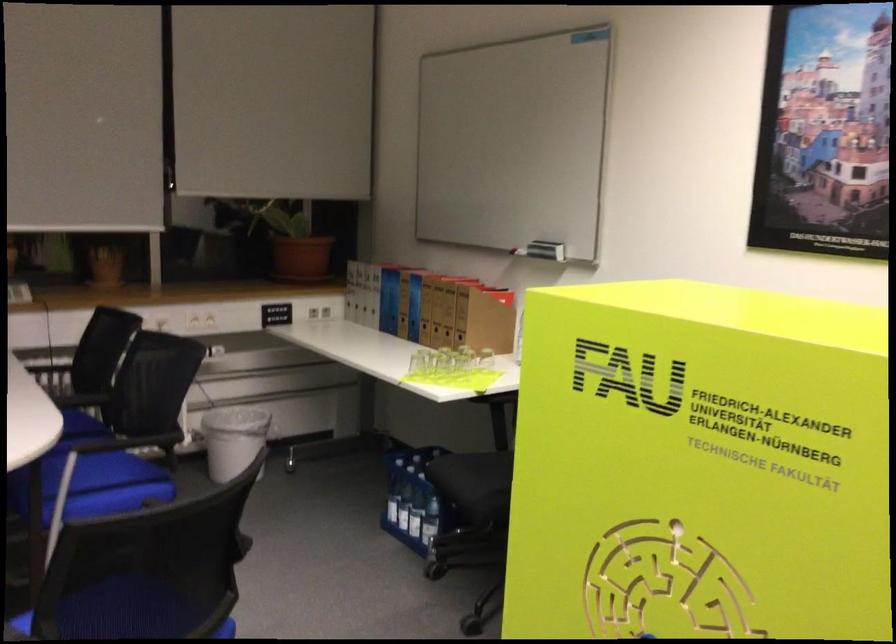
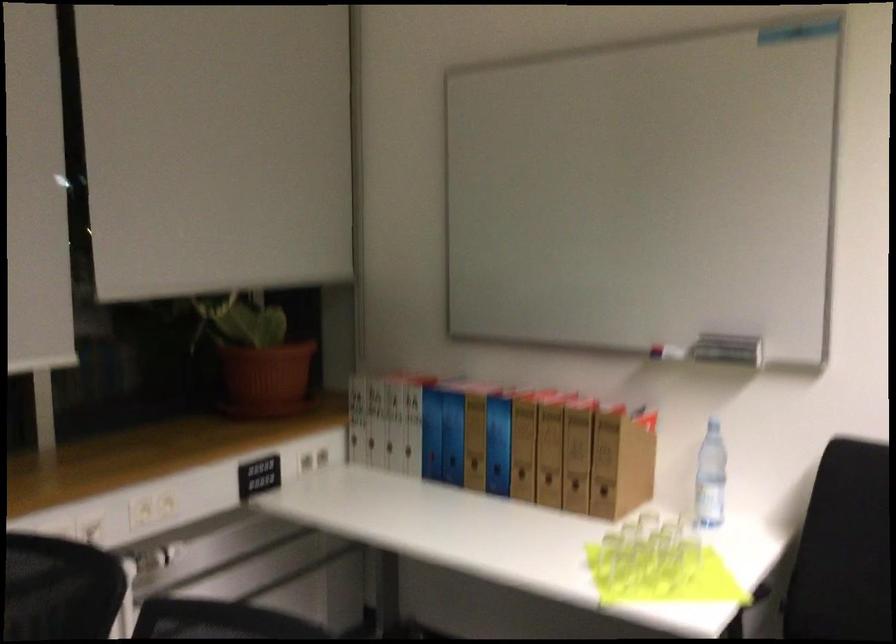
In a continuous first-person perspective shot, in which direction is the camera moving?

The cameraman moved toward left, forward.